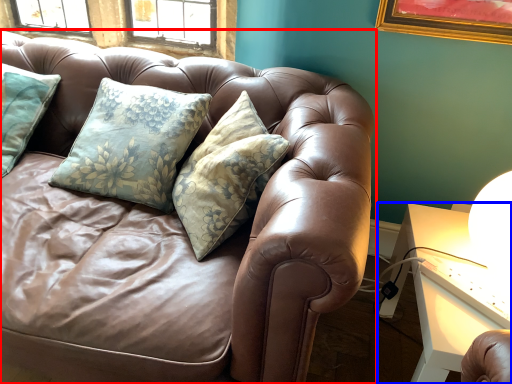
Question: Which point is further to the camera, studio couch (highlighted by a red box) or table (highlighted by a blue box)?

Choices:
 (A) studio couch
 (B) table

Answer: (B)